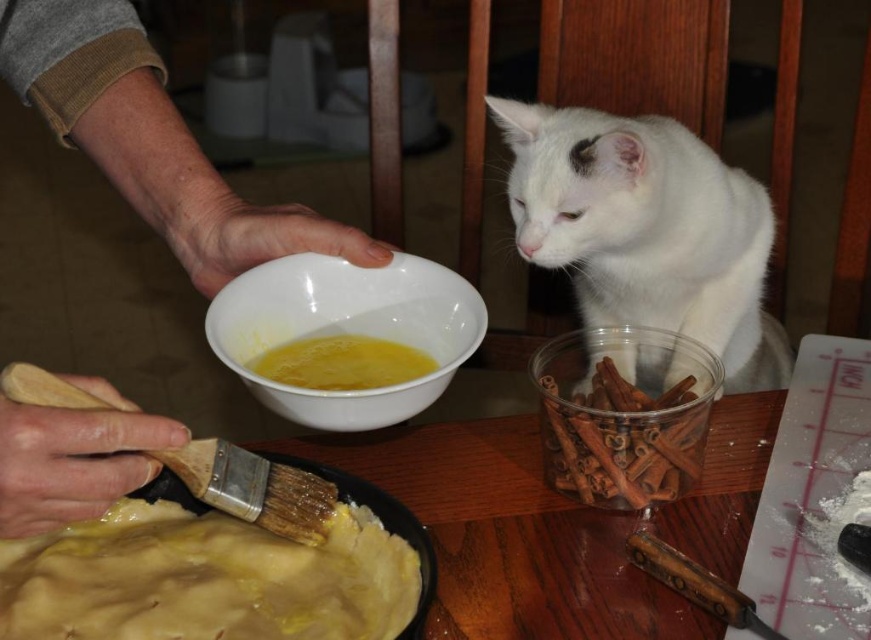
Which of these two, wooden bristles at lower left or yellow liquid at center, stands shorter?

yellow liquid at center

Which is more to the left, wooden bristles at lower left or yellow liquid at center?

wooden bristles at lower left is more to the left.

Find the location of a particular element. Image resolution: width=871 pixels, height=640 pixels. wooden bristles at lower left is located at coordinates (254, 488).

Identify the location of wooden bristles at lower left. Image resolution: width=871 pixels, height=640 pixels. (254, 488).

Who is more distant from viewer, (9,572) or (72,396)?

Positioned behind is point (9,572).

Is yellow matte pie crust at lower left taller than wooden bristles at lower left?

No.

Identify the location of yellow matte pie crust at lower left. (206, 579).

Is brown translucent plastic container at lower right thinner than wooden bristles at lower left?

Yes.

Is point (700, 365) closer to viewer compared to point (7, 380)?

No, (700, 365) is behind (7, 380).

Identify the location of brown translucent plastic container at lower right. (620, 433).